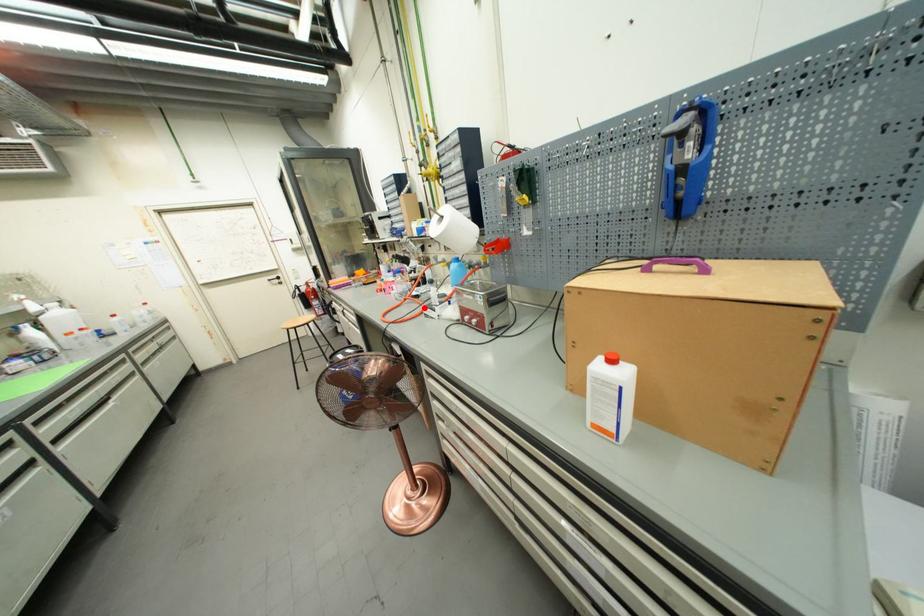
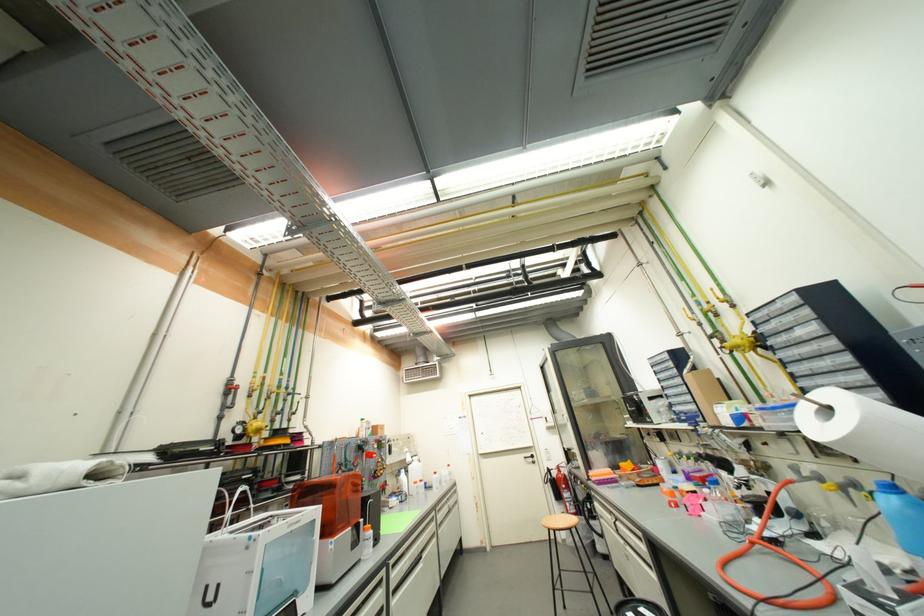
The point at the highlighted location is marked in the first image. Where is the corresponding point in the second image?

(817, 578)